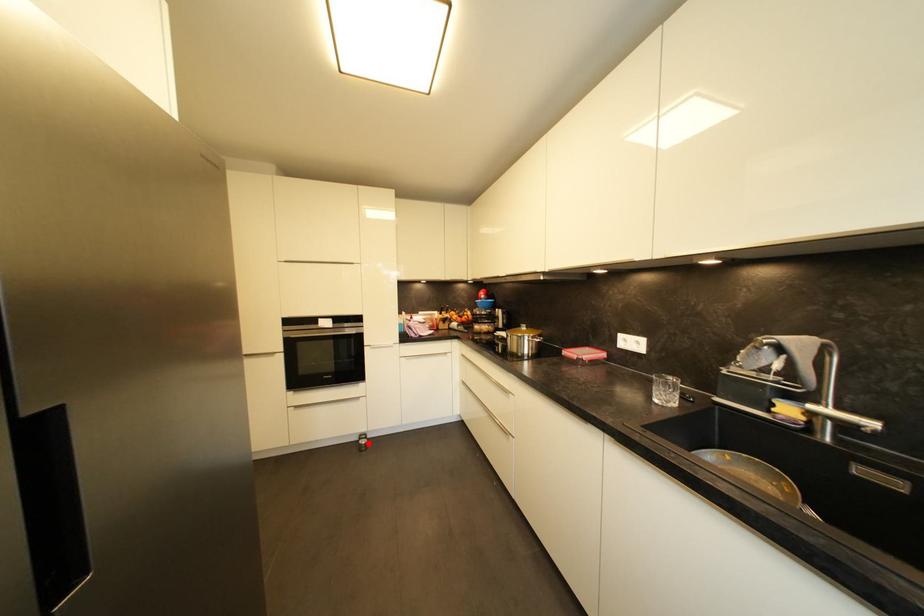
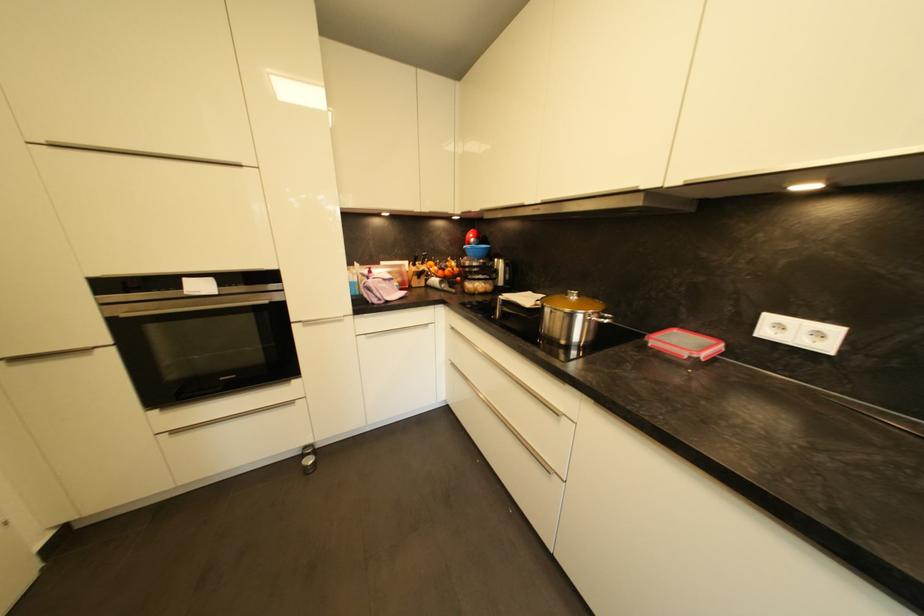
Where in the second image is the point corresponding to the highlighted location from the first image?

(313, 463)